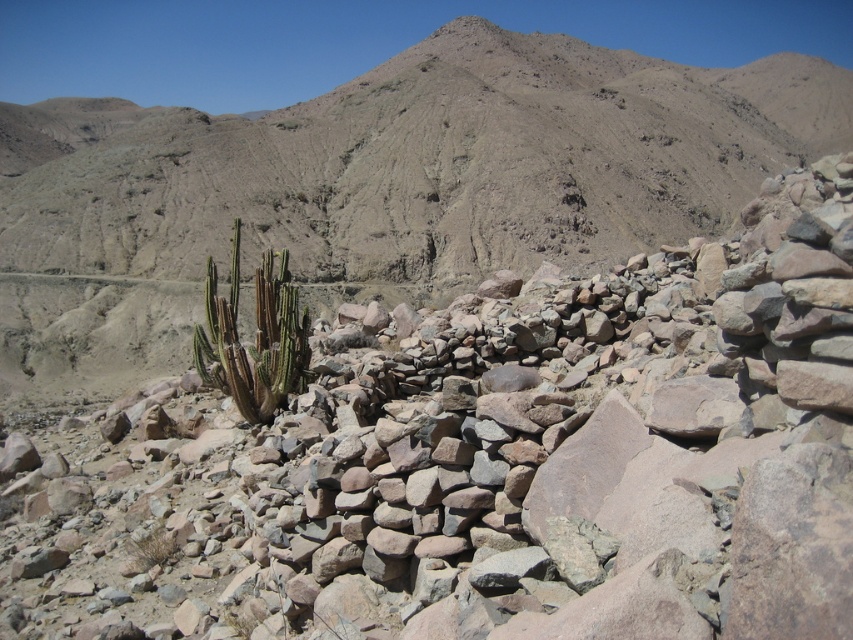
Does green spiny cactus at center have a greater height compared to green spiky cactus at lower left?

Yes.

Which of these two, green spiny cactus at center or green spiky cactus at lower left, stands shorter?

green spiky cactus at lower left is shorter.

The width and height of the screenshot is (853, 640). Identify the location of green spiny cactus at center. (254, 337).

This screenshot has height=640, width=853. In order to click on dull brown rock at center in this screenshot , I will do `click(378, 184)`.

Who is more forward, (x=357, y=147) or (x=202, y=349)?

Positioned in front is point (x=202, y=349).

At what (x,y) coordinates should I click in order to perform the action: click on dull brown rock at center. Please return your answer as a coordinate pair (x, y). Looking at the image, I should click on (378, 184).

Does point (415, 77) come in front of point (120, 572)?

That is False.

Which is in front, point (206, 244) or point (148, 554)?

Point (148, 554) is in front.

Where is `dull brown rock at center`? The width and height of the screenshot is (853, 640). dull brown rock at center is located at coordinates (378, 184).